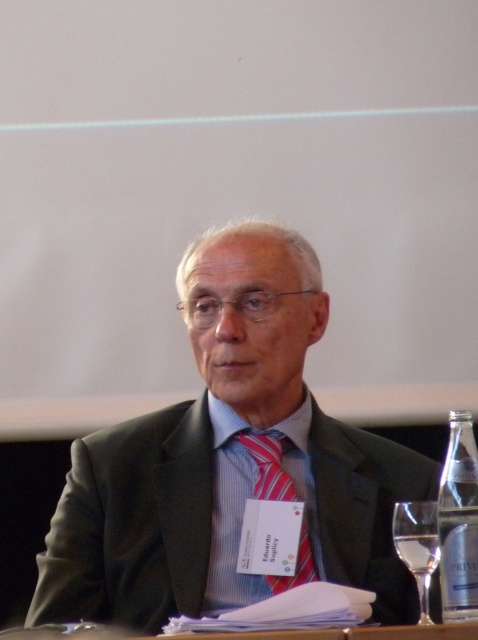
Does matte black suit at center appear over striped silk tie at center?

Correct, matte black suit at center is located above striped silk tie at center.

Looking at this image, who is shorter, matte black suit at center or striped silk tie at center?

Standing shorter between the two is striped silk tie at center.

This screenshot has width=478, height=640. I want to click on matte black suit at center, so click(x=230, y=461).

From the picture: Does striped silk tie at center have a greater height compared to clear glass wine glass at lower right?

Yes, striped silk tie at center is taller than clear glass wine glass at lower right.

Does striped silk tie at center appear on the right side of clear glass wine glass at lower right?

Incorrect, striped silk tie at center is not on the right side of clear glass wine glass at lower right.

Between point (285, 444) and point (413, 520), which one is positioned in front?

Point (413, 520) is more forward.

Find the location of a particular element. This screenshot has height=640, width=478. striped silk tie at center is located at coordinates (268, 465).

Does clear glass bottle at lower right have a larger size compared to clear glass wine glass at lower right?

Correct, clear glass bottle at lower right is larger in size than clear glass wine glass at lower right.

Does point (447, 611) come farther from viewer compared to point (430, 572)?

No, it is in front of (430, 572).

What are the coordinates of `clear glass bottle at lower right` in the screenshot? It's located at (458, 522).